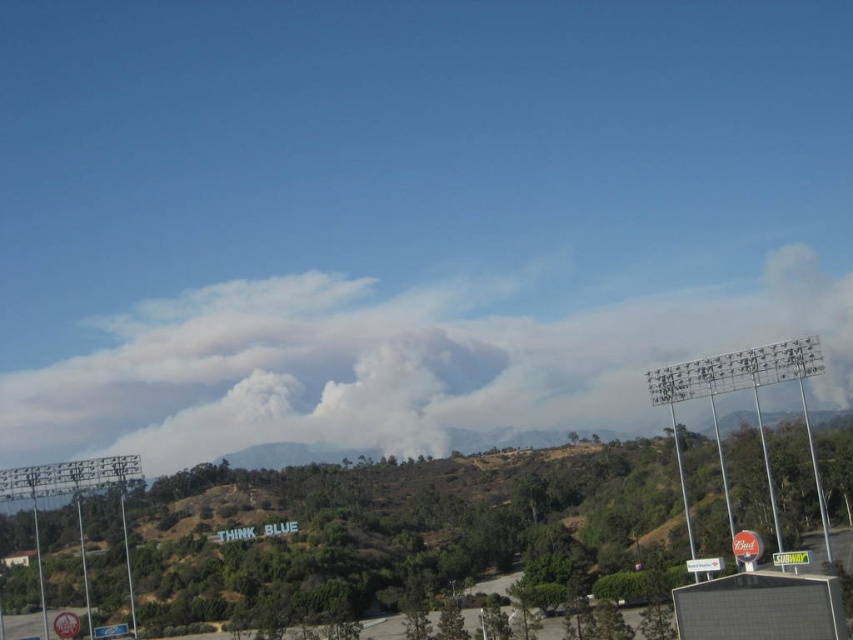
Question: Can you confirm if white smoke cloud at center is thinner than green grassy hillside at center?

Choices:
 (A) no
 (B) yes

Answer: (A)

Question: Is white smoke cloud at center below green grassy hillside at center?

Choices:
 (A) no
 (B) yes

Answer: (A)

Question: Observing the image, what is the correct spatial positioning of white smoke cloud at center in reference to green grassy hillside at center?

Choices:
 (A) left
 (B) right

Answer: (A)

Question: Which of the following is the closest to the observer?

Choices:
 (A) (73, 449)
 (B) (460, 509)

Answer: (B)

Question: Which of the following is the closest to the observer?

Choices:
 (A) white smoke cloud at center
 (B) green grassy hillside at center

Answer: (B)